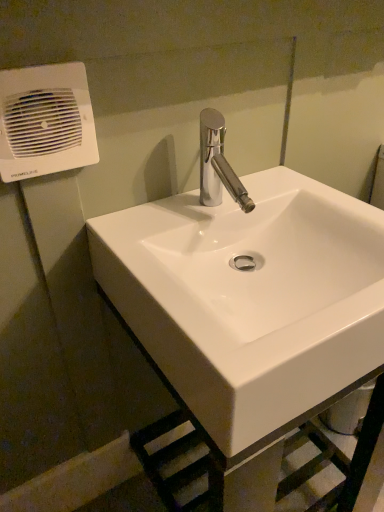
Question: Is white plastic air conditioning at upper left taller or shorter than white glossy sink at center?

Choices:
 (A) short
 (B) tall

Answer: (A)

Question: Relative to white glossy sink at center, is white plastic air conditioning at upper left in front or behind?

Choices:
 (A) front
 (B) behind

Answer: (B)

Question: Visually, is white plastic air conditioning at upper left positioned to the left or to the right of white glossy sink at center?

Choices:
 (A) right
 (B) left

Answer: (B)

Question: From the image's perspective, is white glossy sink at center above or below white plastic air conditioning at upper left?

Choices:
 (A) below
 (B) above

Answer: (A)

Question: Considering the positions of point (215, 380) and point (16, 157), is point (215, 380) closer or farther from the camera than point (16, 157)?

Choices:
 (A) closer
 (B) farther

Answer: (A)

Question: Would you say white glossy sink at center is to the left or to the right of white plastic air conditioning at upper left in the picture?

Choices:
 (A) right
 (B) left

Answer: (A)

Question: Is white glossy sink at center inside or outside of white plastic air conditioning at upper left?

Choices:
 (A) inside
 (B) outside

Answer: (B)